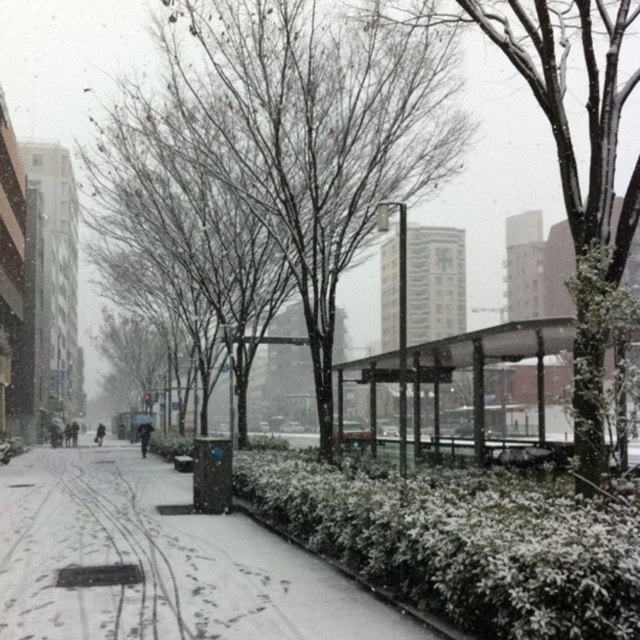
Find the location of a particular element. The height and width of the screenshot is (640, 640). bare branches at center is located at coordinates (298, 132).

Is bare branches at center closer to the viewer compared to transparent plastic bus stop at center?

That is False.

Where is `bare branches at center`? The height and width of the screenshot is (640, 640). bare branches at center is located at coordinates (298, 132).

In the scene shown: Does bare branches at center appear on the left side of snow-covered concrete sidewalk at lower left?

No, bare branches at center is not to the left of snow-covered concrete sidewalk at lower left.

Who is higher up, bare branches at center or snow-covered concrete sidewalk at lower left?

Positioned higher is bare branches at center.

Who is more forward, (298, 179) or (52, 625)?

Point (52, 625) is in front.

At what (x,y) coordinates should I click in order to perform the action: click on bare branches at center. Please return your answer as a coordinate pair (x, y). This screenshot has width=640, height=640. Looking at the image, I should click on (298, 132).

Which is below, snow-covered concrete sidewalk at lower left or snow-covered tree at center?

Positioned lower is snow-covered concrete sidewalk at lower left.

Who is taller, snow-covered concrete sidewalk at lower left or snow-covered tree at center?

snow-covered tree at center

Is point (72, 452) positioned behind point (371, 10)?

Yes, point (72, 452) is farther from viewer.

Where is `snow-covered concrete sidewalk at lower left`? This screenshot has width=640, height=640. snow-covered concrete sidewalk at lower left is located at coordinates (160, 561).